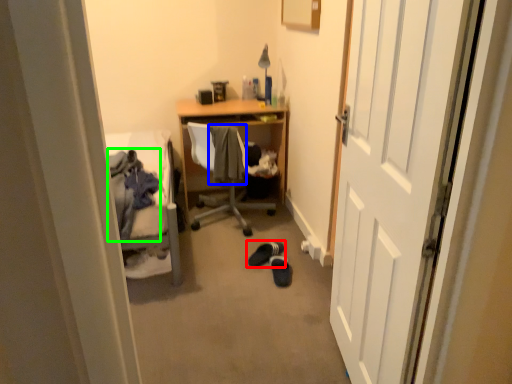
Question: Which object is the farthest from footwear (highlighted by a red box)? Choose among these: clothing (highlighted by a blue box) or clothing (highlighted by a green box).

Choices:
 (A) clothing
 (B) clothing

Answer: (B)